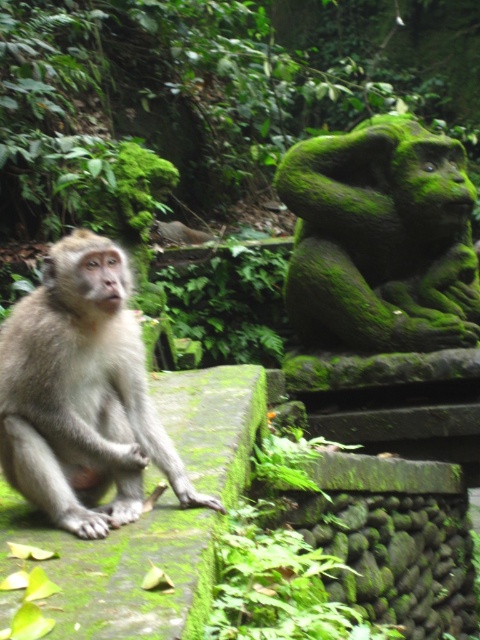
Question: Can you confirm if green mossy statue at right is positioned below light brown fur monkey at center?

Choices:
 (A) no
 (B) yes

Answer: (A)

Question: Can you confirm if green mossy statue at right is positioned below light brown fur monkey at center?

Choices:
 (A) no
 (B) yes

Answer: (A)

Question: Which point is farther to the camera?

Choices:
 (A) green mossy statue at right
 (B) light brown fur monkey at center

Answer: (A)

Question: Is green mossy statue at right to the left of light brown fur monkey at center from the viewer's perspective?

Choices:
 (A) yes
 (B) no

Answer: (B)

Question: Among these points, which one is nearest to the camera?

Choices:
 (A) (91, 291)
 (B) (295, 211)

Answer: (A)